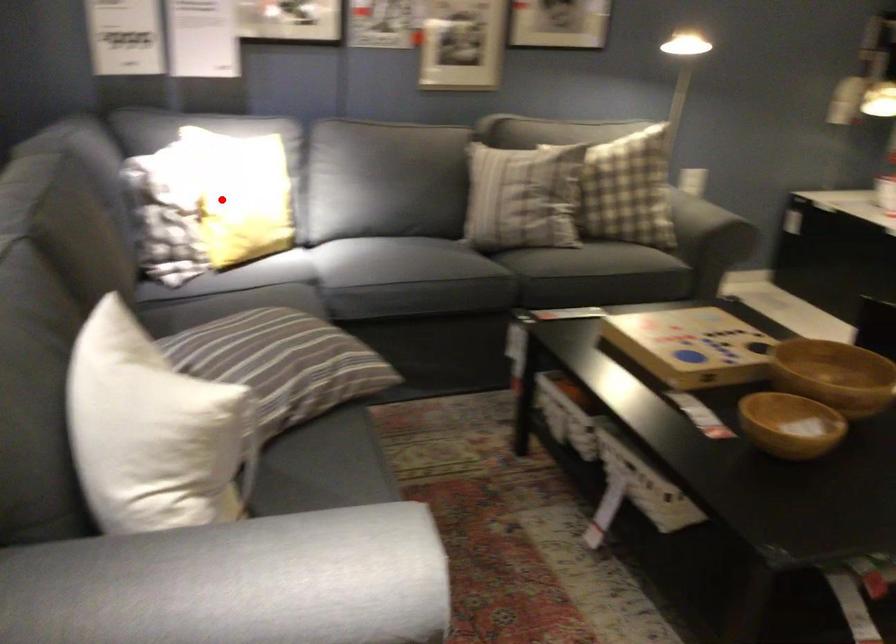
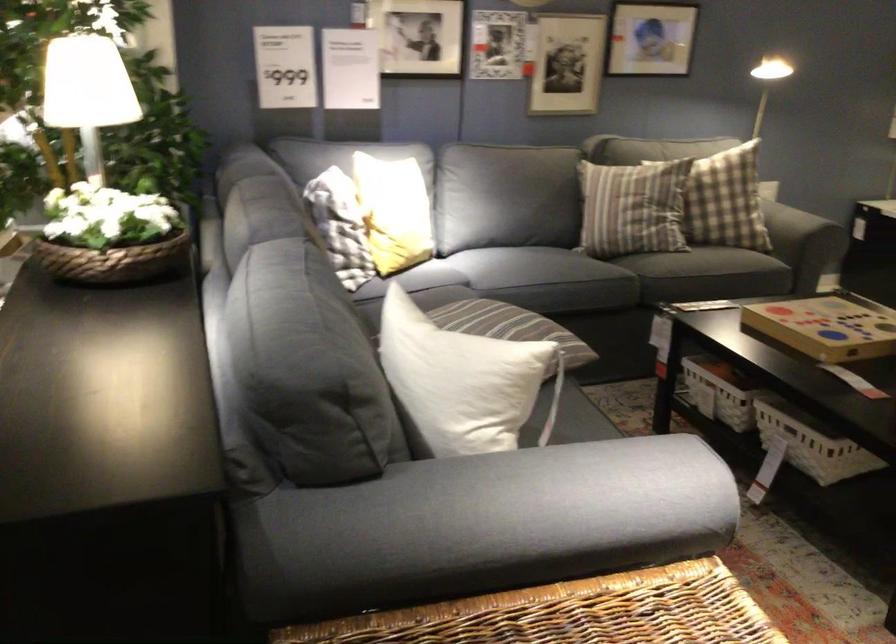
Question: I am providing you with two images of the same scene from different viewpoints. Given a red point in image1, look at the same physical point in image2. Is it:

Choices:
 (A) Closer to the viewpoint
 (B) Farther from the viewpoint

Answer: (B)